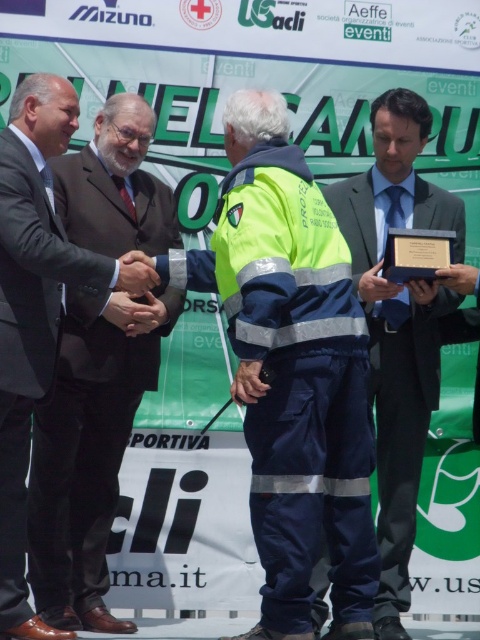
Question: Does matte black suit at left have a greater width compared to matte black suit at center?

Choices:
 (A) no
 (B) yes

Answer: (A)

Question: Which point is closer to the camera?

Choices:
 (A) (403, 307)
 (B) (336, 570)
 (C) (73, 600)

Answer: (B)

Question: Which point is farther to the camera?

Choices:
 (A) matte black suit at center
 (B) matte black suit at left
 (C) high-visibility fabric construction worker at center

Answer: (A)

Question: Which point is farther from the camera taking this photo?

Choices:
 (A) (395, 560)
 (B) (63, 406)

Answer: (A)

Question: In this image, where is high-visibility fabric construction worker at center located relative to matte black suit at center?

Choices:
 (A) right
 (B) left

Answer: (B)

Question: Is high-visibility fabric construction worker at center closer to camera compared to matte black suit at left?

Choices:
 (A) yes
 (B) no

Answer: (A)